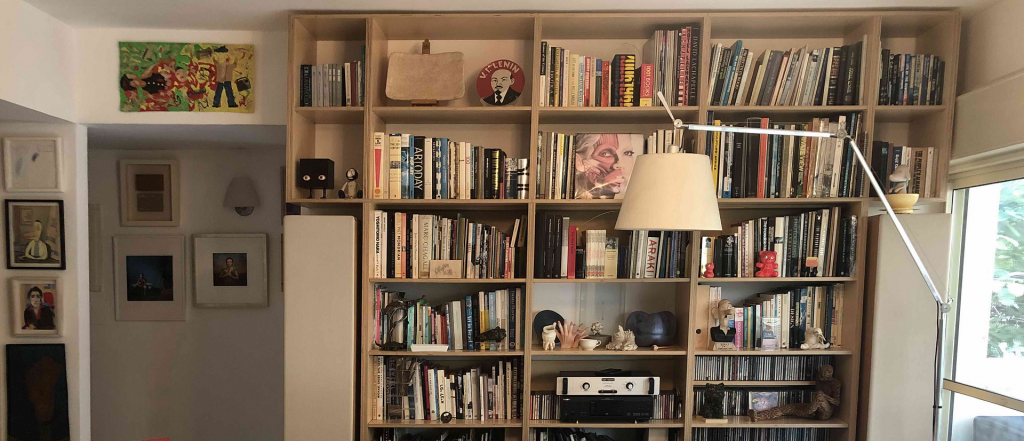
At what (x,y) coordinates should I click in order to perform the action: click on bottom window panel. Please return your answer as a coordinate pair (x, y). Image resolution: width=1024 pixels, height=441 pixels. Looking at the image, I should click on (964, 421).